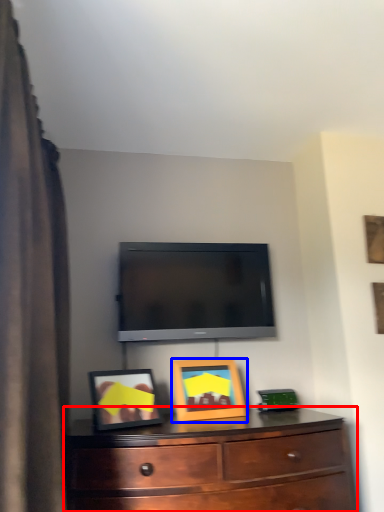
Question: Among these objects, which one is farthest to the camera, chest of drawers (highlighted by a red box) or picture frame (highlighted by a blue box)?

Choices:
 (A) chest of drawers
 (B) picture frame

Answer: (B)